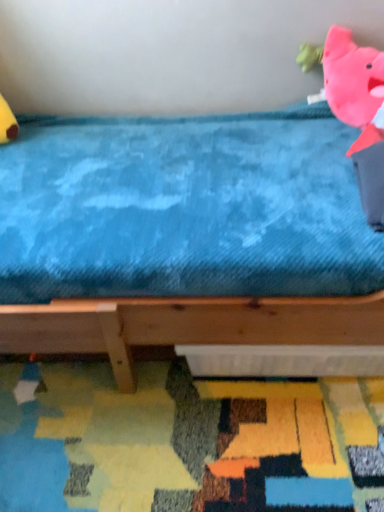
Find the location of a particular element. The image size is (384, 512). free region under textured multicolored mat at lower center (from a real-world perspective) is located at coordinates (185, 450).